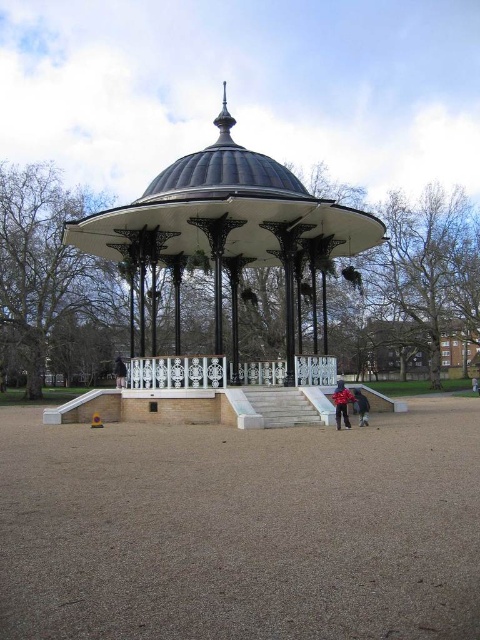
Between red fabric jacket at center and black fabric at lower center, which one has more height?

Standing taller between the two is black fabric at lower center.

Between point (339, 384) and point (118, 387), which one is positioned in front?

Point (339, 384)

Locate an element on the screen. The height and width of the screenshot is (640, 480). red fabric jacket at center is located at coordinates (342, 403).

Is white painted metal gazebo at center taller than black fabric at lower center?

Correct, white painted metal gazebo at center is much taller as black fabric at lower center.

Which is behind, point (260, 253) or point (118, 381)?

The point (260, 253) is behind.

This screenshot has width=480, height=640. I want to click on white painted metal gazebo at center, so click(228, 218).

Between point (252, 186) and point (355, 397), which one is positioned behind?

The point (252, 186) is more distant.

Can you confirm if white painted metal gazebo at center is bigger than red jacket at lower center?

Yes.

The height and width of the screenshot is (640, 480). I want to click on white painted metal gazebo at center, so click(228, 218).